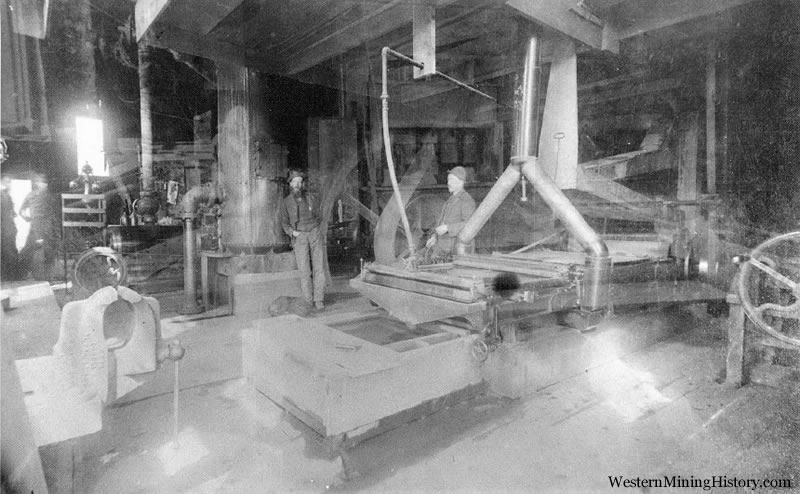
Where is `ceiling`? The width and height of the screenshot is (800, 494). ceiling is located at coordinates (314, 24).